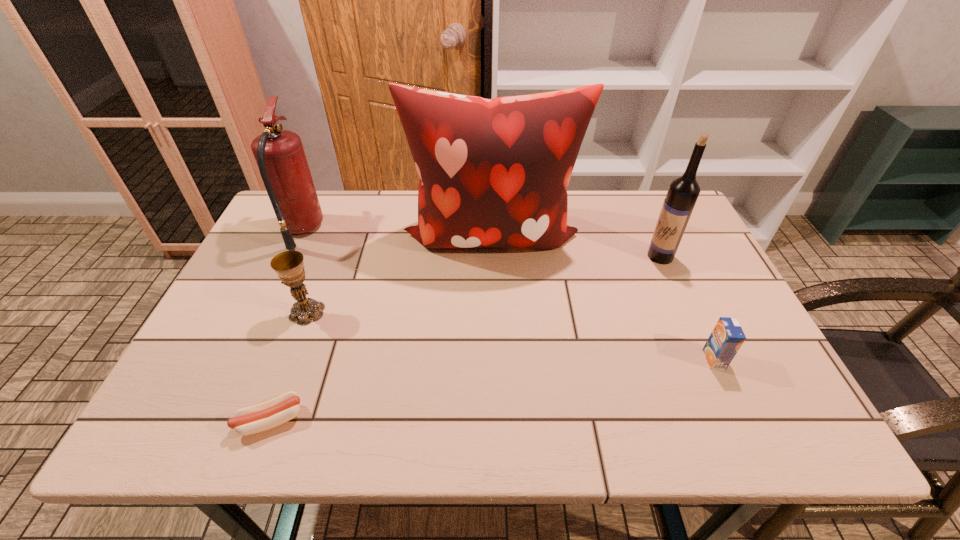
Where is `cushion`? This screenshot has width=960, height=540. cushion is located at coordinates (x=493, y=172).

I want to click on the tallest object, so click(x=493, y=172).

Find the location of a particular element. The width and height of the screenshot is (960, 540). fire extinguisher is located at coordinates (282, 163).

I want to click on wine bottle, so click(683, 192).

Locate an element on the screen. The width and height of the screenshot is (960, 540). the fourth tallest object is located at coordinates (289, 266).

Where is `the third nearest object`? The image size is (960, 540). the third nearest object is located at coordinates (289, 266).

Where is `orange_juice`? Image resolution: width=960 pixels, height=540 pixels. orange_juice is located at coordinates (727, 337).

This screenshot has width=960, height=540. What are the coordinates of `the second shortest object` in the screenshot? It's located at (727, 337).

At what (x,y) coordinates should I click in order to perform the action: click on sausage. Please return your answer as a coordinate pair (x, y). The width and height of the screenshot is (960, 540). Looking at the image, I should click on (264, 416).

At what (x,y) coordinates should I click in order to perform the action: click on the shortest object. Please return your answer as a coordinate pair (x, y). Image resolution: width=960 pixels, height=540 pixels. Looking at the image, I should click on (264, 416).